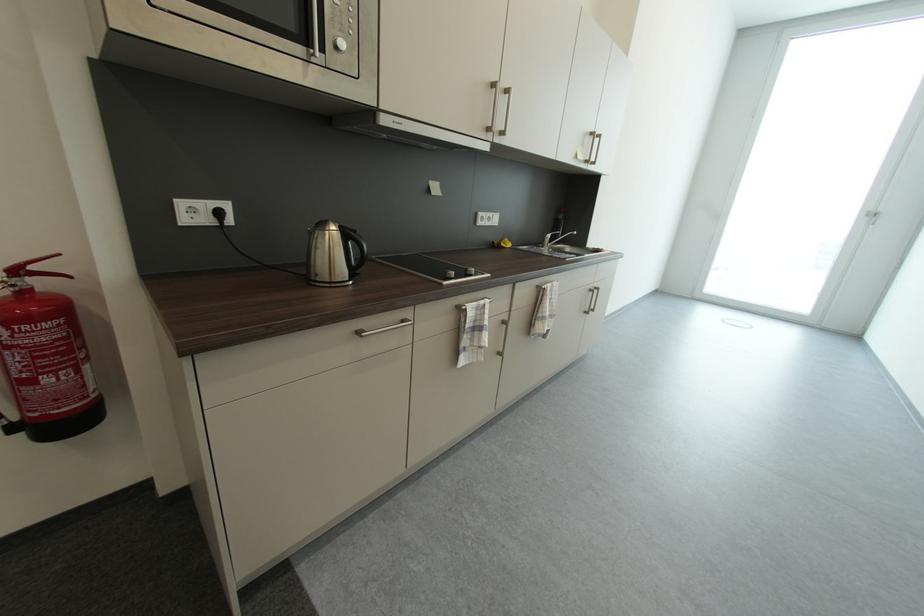
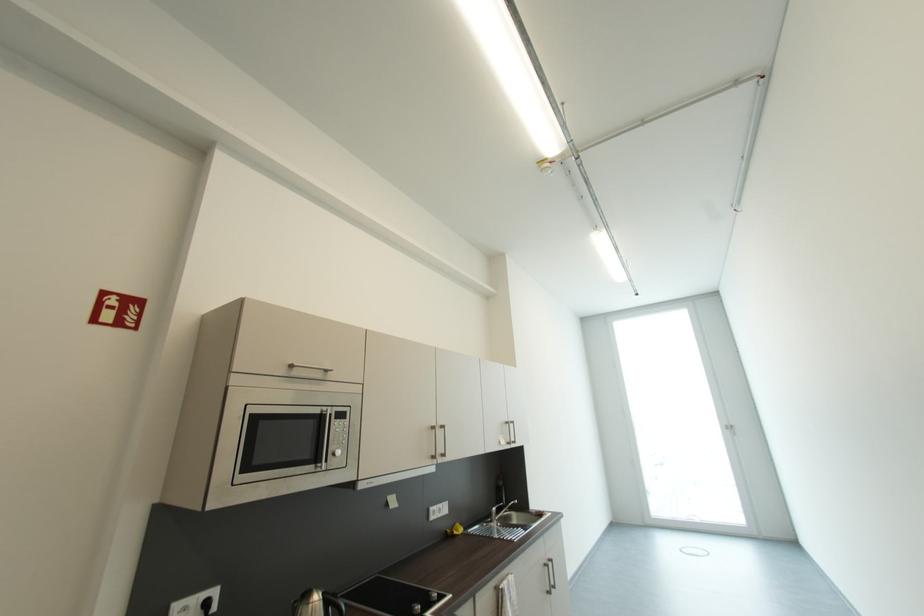
The point at (225, 215) is marked in the first image. Where is the corresponding point in the second image?

(213, 605)